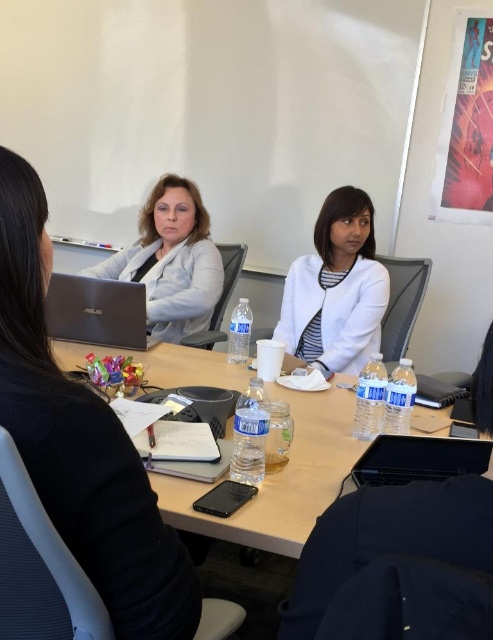
You are organizing a conference and need to place a silver metallic laptop at lower left and clear plastic water bottles at center on a table. Given their widths, which item requires more horizontal space on the table?

The clear plastic water bottles at center require more horizontal space on the table since their width surpasses that of the silver metallic laptop at lower left.

You are a participant in the meeting and need to access the silver metallic laptop at lower left during the discussion. Since you are sitting at the white matte jacket at center, can you easily reach it without moving your chair?

The silver metallic laptop at lower left is behind the white matte jacket at center, so you would need to move your chair or lean back to reach it since it is positioned behind you.

You are a participant in the meeting and want to reach for the black matte laptop at center without disturbing the white matte jacket at center. Which object is closer to you, and can you access the laptop easily?

The white matte jacket at center is closer to you than the black matte laptop at center. Since the jacket is in front of the laptop, you might need to move it aside to access the laptop, which could disturb the jacket.